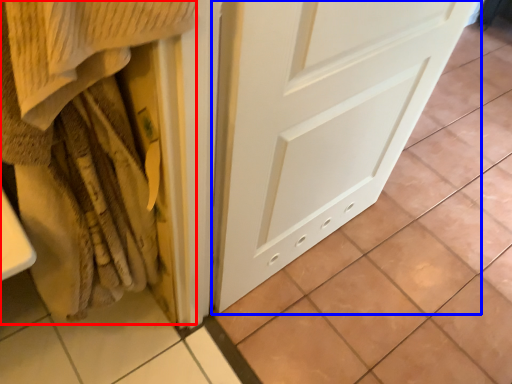
Question: Which of the following is the closest to the observer, blanket (highlighted by a red box) or door (highlighted by a blue box)?

Choices:
 (A) blanket
 (B) door

Answer: (A)